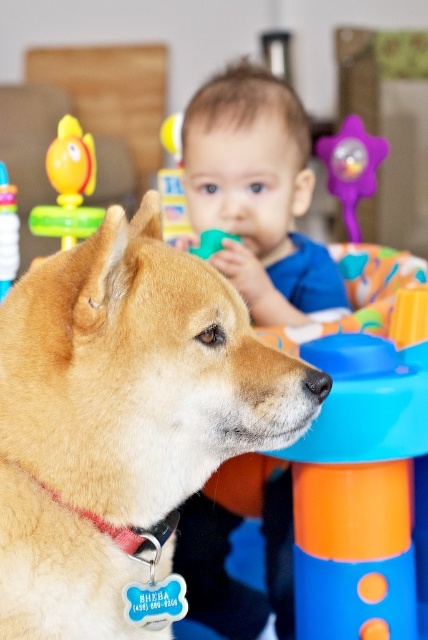
You are a photographer standing at the camera position. You want to take a closeup of the Shiba Inu dog and the baby in the activity center. The camera can only focus on objects within 40 inches. Will the point at coordinates point (65, 564) be in focus?

The point at coordinates point (65, 564) is 38.07 inches from the camera, which is within the 40 inches focus range. Therefore, the point will be in focus.